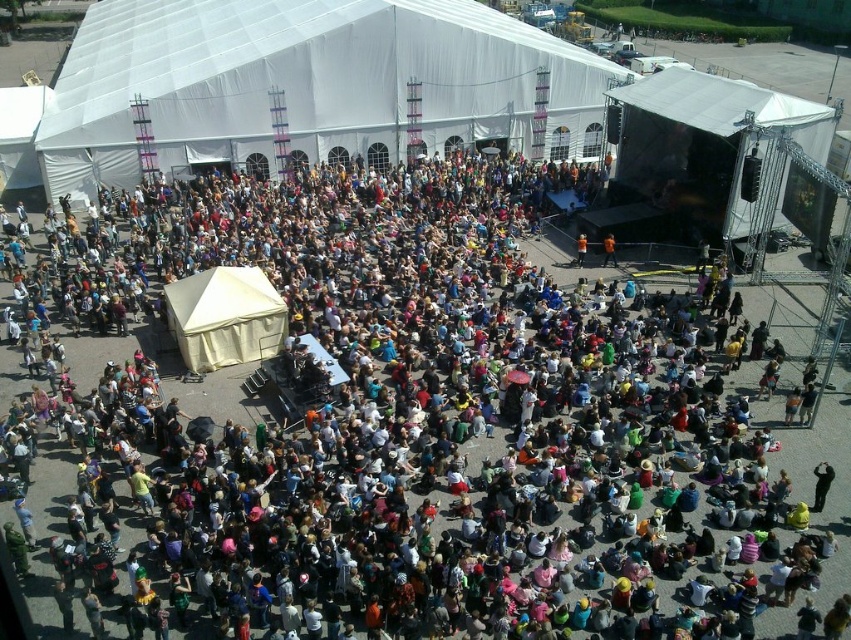
Question: Does white matte tent at upper right come behind white canvas tent at center?

Choices:
 (A) yes
 (B) no

Answer: (A)

Question: Estimate the real-world distances between objects in this image. Which object is farther from the white fabric canopy at upper center?

Choices:
 (A) white matte tent at upper right
 (B) white canvas tent at center

Answer: (B)

Question: Which object is farther from the camera taking this photo?

Choices:
 (A) white canvas tent at center
 (B) white fabric canopy at upper center
 (C) white matte tent at upper right

Answer: (B)

Question: Does white matte tent at upper right appear on the left side of white canvas tent at center?

Choices:
 (A) yes
 (B) no

Answer: (B)

Question: Is the position of white fabric canopy at upper center more distant than that of white matte tent at upper right?

Choices:
 (A) yes
 (B) no

Answer: (A)

Question: Which of the following is the farthest from the observer?

Choices:
 (A) (744, 218)
 (B) (200, 344)

Answer: (A)